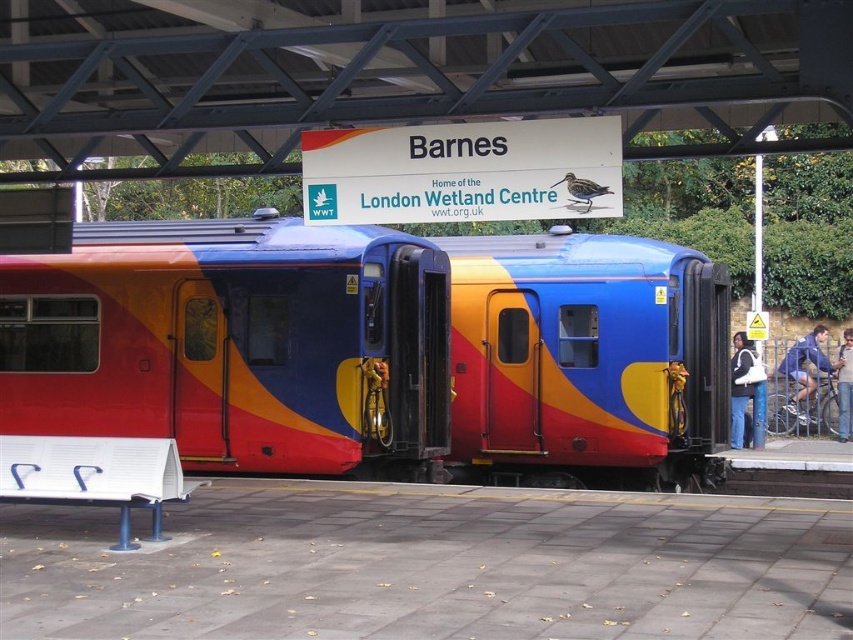
You are standing on the train station platform and want to board the matte plastic train at center. Which direction should you walk to reach it?

Since the matte plastic train at center is located at coordinates point (375,349), you should walk towards the center of the platform to reach it.

You are a passenger waiting on the platform and see the matte plastic train at center and the matte black jacket at lower right. Which object is closer to you?

The matte plastic train at center is closer to you because it is in front of the matte black jacket at lower right.